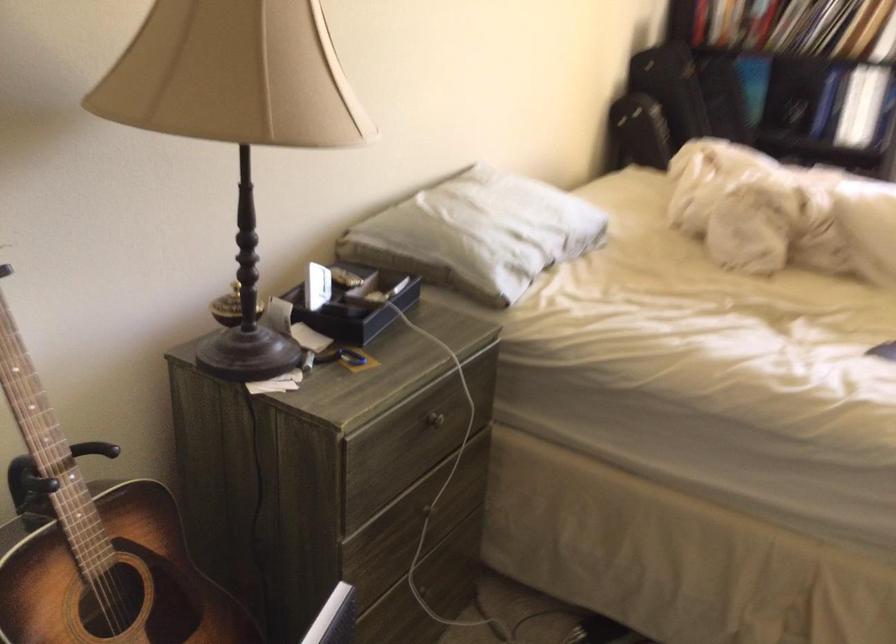
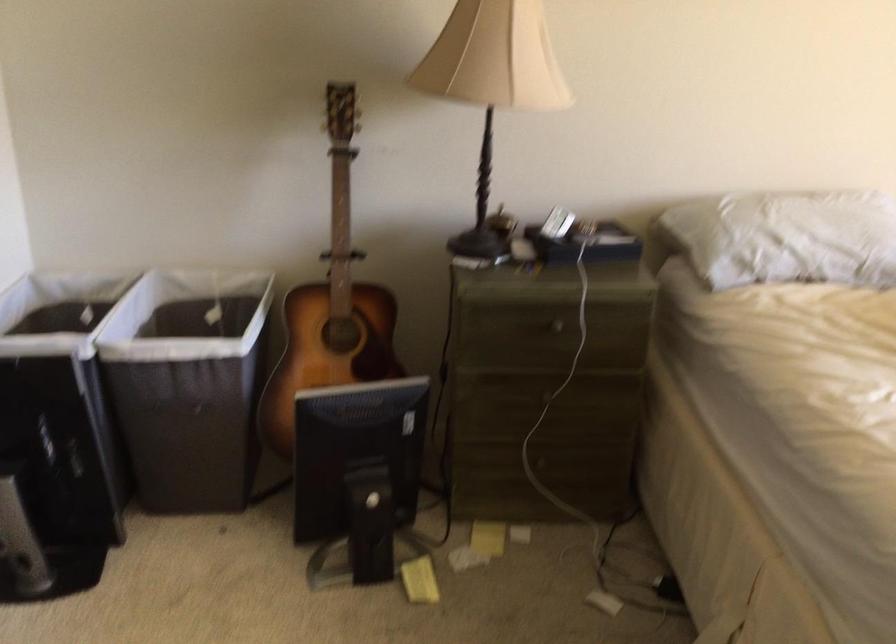
Find the pixel in the second image that matches (x=522, y=232) in the first image.

(786, 237)